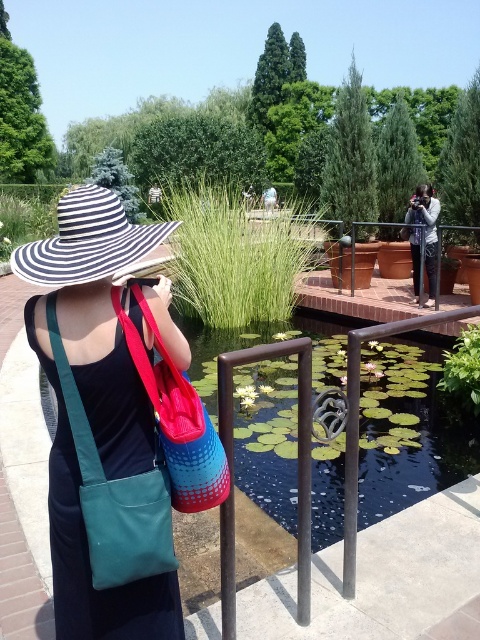
You are a photographer trying to place your matte black camera at center on the brick wall next to your matte blue bag at center. Can you fit both items side by side on the wall without overlapping?

The matte blue bag at center might be wider than matte black camera at center, so there is a possibility that they might overlap if placed side by side on the wall.

You are a photographer preparing to take a photo of the pond. You have a matte blue bag at center and a matte black camera at center. Where should you position your camera relative to the bag to ensure it doesn not block the view of the pond?

The matte blue bag at center is below the matte black camera at center, so positioning the camera above the matte blue bag at center will keep it out of the way and ensure the pond remains visible.

You are standing at the point labeled as point (414,282) and want to walk to the point labeled as point (96,595). According to the scene description, which direction should you move to reach your destination?

You should move forward because point (96,595) is in front of point (414,282).